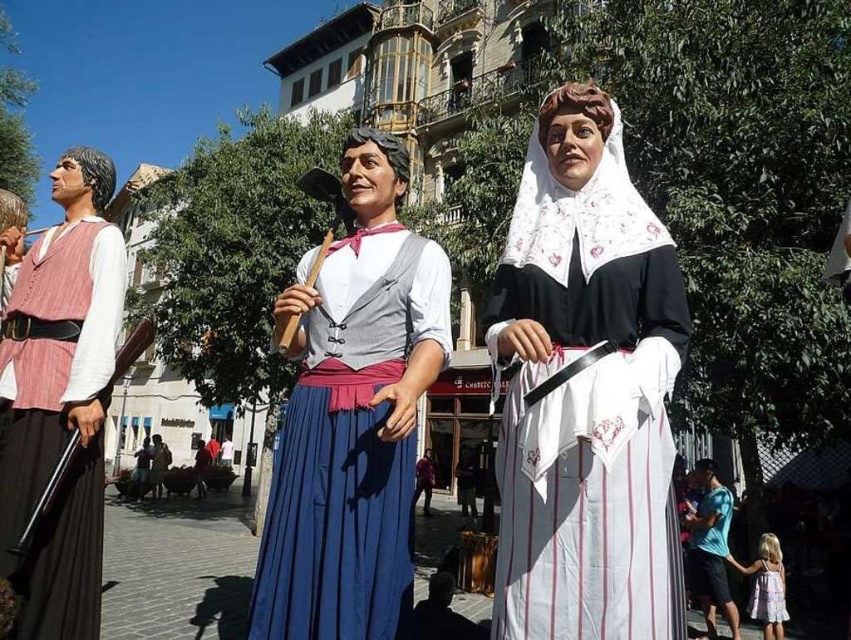
You are attending a traditional Catalan parade and notice two items in the scene. The first is a matte pink vest at left, and the second is a white striped fabric at center. From your perspective, which item is positioned to the right of the other?

The white striped fabric at center is to the right of the matte pink vest at left.

You are a spectator at a Catalan festival and notice two fabrics in the central area of the image. Which fabric is closer to you, the white striped fabric at center or the blue fabric skirt at center?

The white striped fabric at center is closer to you because it is in front of the blue fabric skirt at center.